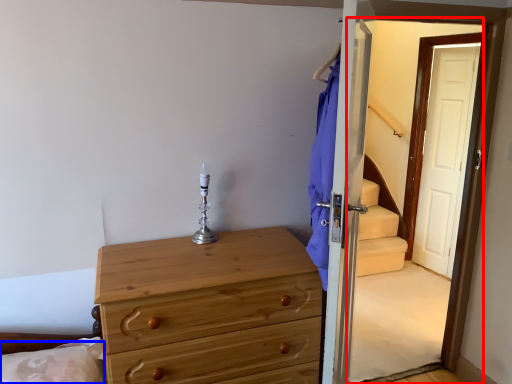
Question: Among these objects, which one is farthest to the camera, screen door (highlighted by a red box) or pillow (highlighted by a blue box)?

Choices:
 (A) screen door
 (B) pillow

Answer: (B)